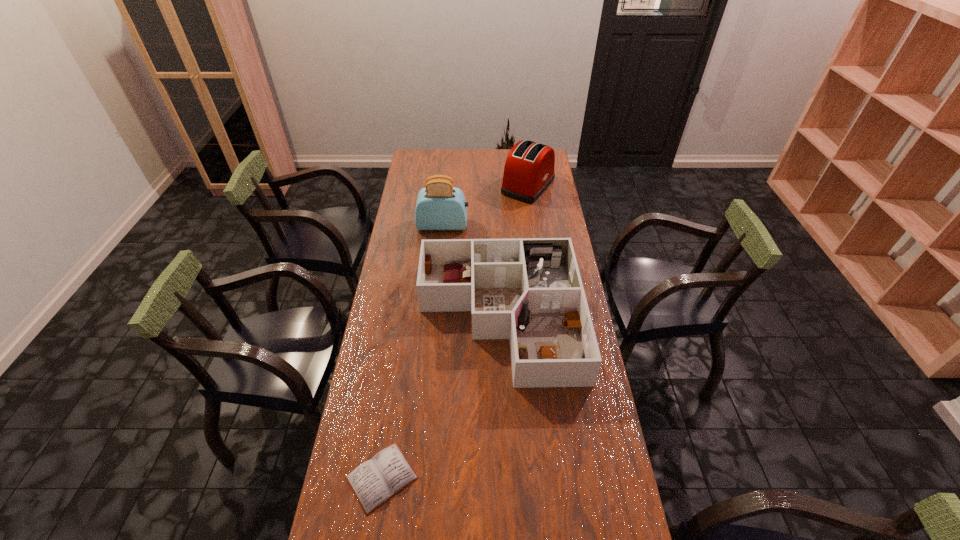
This screenshot has width=960, height=540. I want to click on vacant space located 0.230m on the back of the dollhouse, so click(495, 229).

Where is `blank space located on the right of the nearest object`? The height and width of the screenshot is (540, 960). blank space located on the right of the nearest object is located at coordinates (455, 477).

You are a GUI agent. You are given a task and a screenshot of the screen. Output one action in this format:
    pyautogui.click(x=<x>, y=<y>)
    Task: Click on the object located in the far edge section of the desktop
    This screenshot has height=540, width=960.
    Given the screenshot: What is the action you would take?
    pyautogui.click(x=529, y=169)

The image size is (960, 540). Find the location of `toaster that is at the left edge`. toaster that is at the left edge is located at coordinates (440, 206).

The height and width of the screenshot is (540, 960). Identify the location of dollhouse present at the left edge. (529, 290).

I want to click on diary situated at the left edge, so click(375, 481).

Where is `toaster at the right edge`? toaster at the right edge is located at coordinates [x=529, y=169].

Find the location of a particular element. This screenshot has height=540, width=960. dollhouse present at the right edge is located at coordinates (529, 290).

This screenshot has height=540, width=960. Identify the location of object positioned at the far right corner. (529, 169).

This screenshot has height=540, width=960. What are the coordinates of `vacant position at the far edge of the desktop` in the screenshot? It's located at (493, 162).